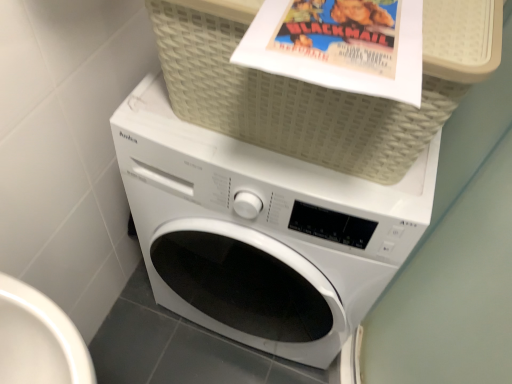
Question: Considering the relative positions of beige woven basket at upper center and white matte washing machine at center in the image provided, is beige woven basket at upper center to the left or to the right of white matte washing machine at center?

Choices:
 (A) left
 (B) right

Answer: (B)

Question: Relative to white matte washing machine at center, is beige woven basket at upper center in front or behind?

Choices:
 (A) behind
 (B) front

Answer: (B)

Question: Considering the positions of beige woven basket at upper center and white matte washing machine at center in the image, is beige woven basket at upper center wider or thinner than white matte washing machine at center?

Choices:
 (A) wide
 (B) thin

Answer: (B)

Question: From a real-world perspective, is white matte washing machine at center physically located above or below beige woven basket at upper center?

Choices:
 (A) above
 (B) below

Answer: (B)

Question: From the image's perspective, relative to beige woven basket at upper center, is white matte washing machine at center above or below?

Choices:
 (A) below
 (B) above

Answer: (A)

Question: Is point (273, 291) positioned closer to the camera than point (436, 66)?

Choices:
 (A) closer
 (B) farther

Answer: (B)

Question: In the image, is white matte washing machine at center positioned in front of or behind beige woven basket at upper center?

Choices:
 (A) behind
 (B) front

Answer: (A)